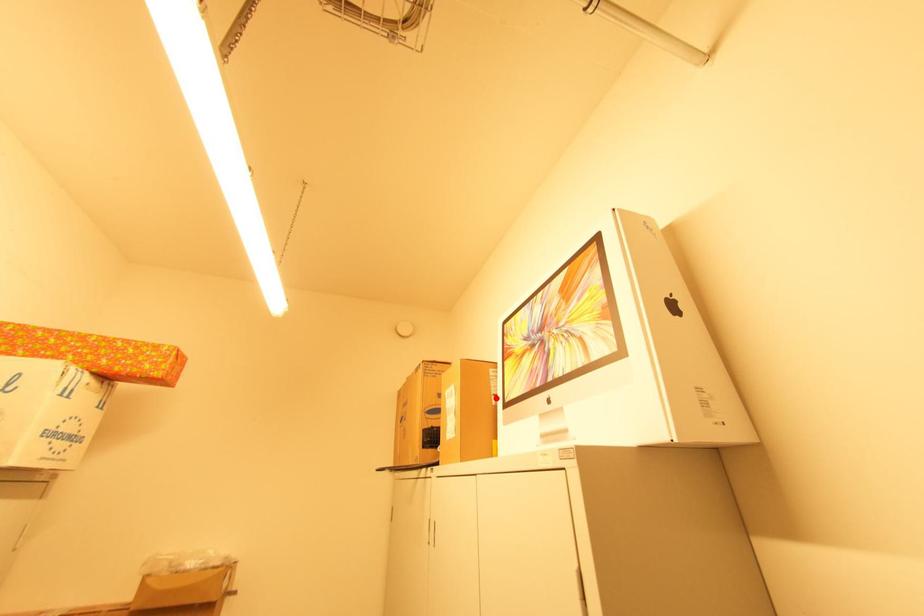
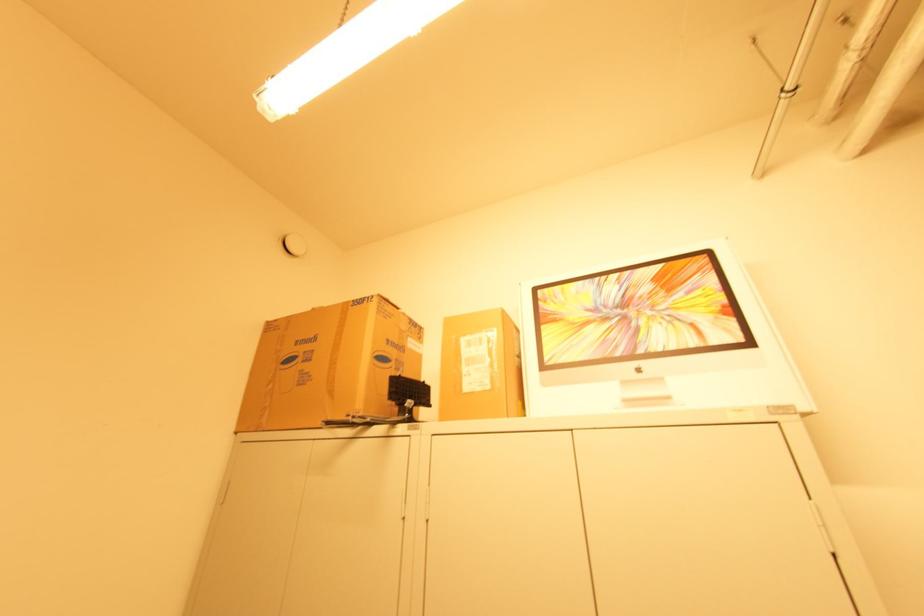
In the second image, find the point that corresponds to the highlighted location in the first image.

(520, 359)